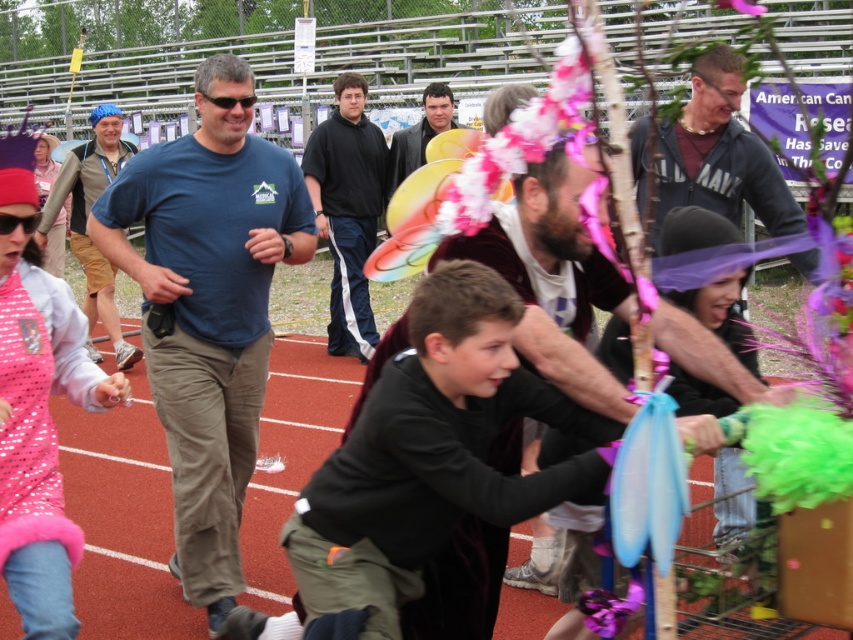
You are a photographer at the event and want to capture a photo that includes both the black matte jacket at upper center and the black fabric at center. Based on their positions, which object should you place on the right side of your frame to ensure both are visible?

The black matte jacket at upper center should be placed on the right side of your frame because it is already positioned on the right side of the black fabric at center, ensuring both objects are visible.